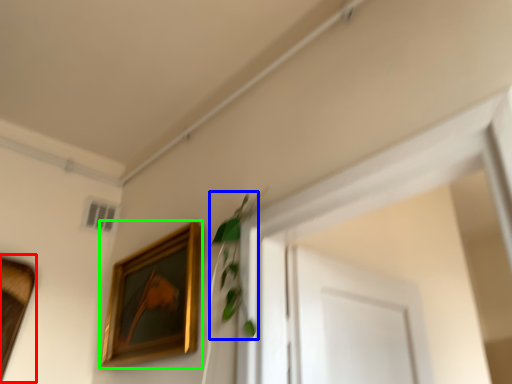
Question: Which object is the farthest from picture frame (highlighted by a red box)? Choose among these: plant (highlighted by a blue box) or picture frame (highlighted by a green box).

Choices:
 (A) plant
 (B) picture frame

Answer: (A)